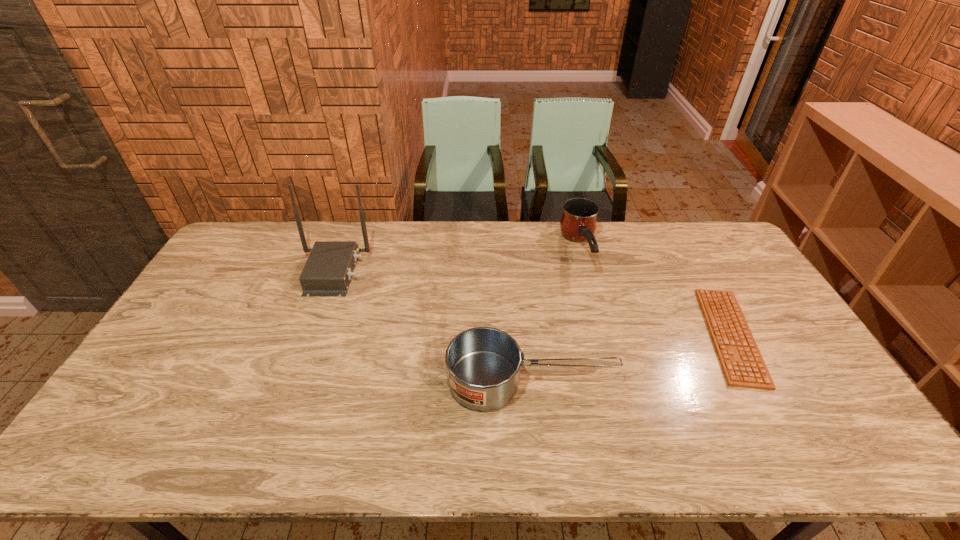
At what (x,y) coordinates should I click in order to perform the action: click on vacant point that satisfies the following two spatial constraints: 1. on the back of the router to connect cables; 2. on the back side of the rightmost object. Please return your answer as a coordinate pair (x, y). The height and width of the screenshot is (540, 960). Looking at the image, I should click on (309, 335).

Where is `free space that satisfies the following two spatial constraints: 1. on the back of the router to connect cables; 2. on the left side of the computer keyboard`? free space that satisfies the following two spatial constraints: 1. on the back of the router to connect cables; 2. on the left side of the computer keyboard is located at coordinates (309, 335).

Image resolution: width=960 pixels, height=540 pixels. In order to click on free space that satisfies the following two spatial constraints: 1. on the handle side of the shortest object; 2. on the right side of the taller saucepan in this screenshot , I will do coord(603,335).

Find the location of a particular element. This screenshot has width=960, height=540. free spot that satisfies the following two spatial constraints: 1. on the handle side of the second tallest object; 2. with the handle extending from one side of the shorter saucepan is located at coordinates (615, 381).